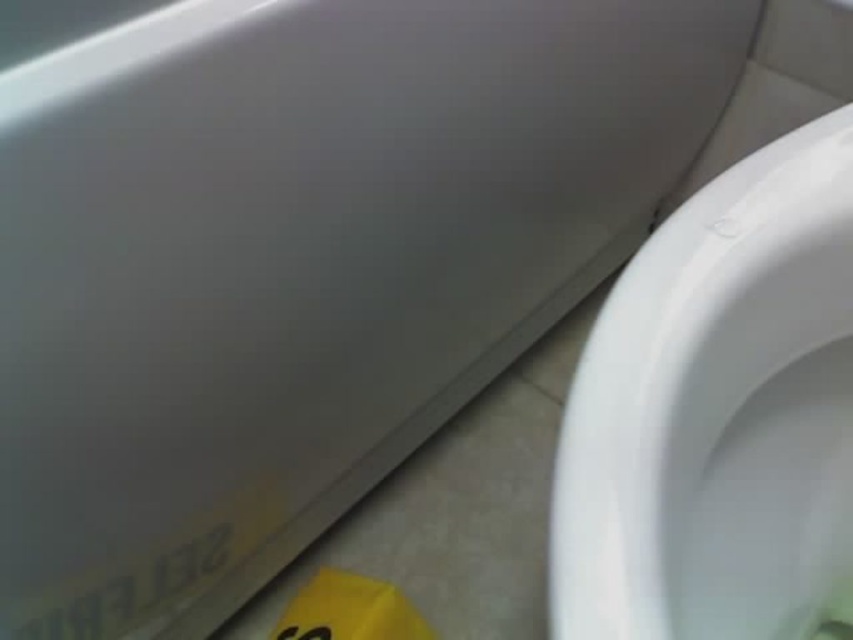
Between white glossy toilet bowl at right and yellow paper at lower left, which one has less height?

With less height is yellow paper at lower left.

The width and height of the screenshot is (853, 640). What do you see at coordinates (718, 413) in the screenshot?
I see `white glossy toilet bowl at right` at bounding box center [718, 413].

This screenshot has width=853, height=640. What do you see at coordinates (718, 413) in the screenshot?
I see `white glossy toilet bowl at right` at bounding box center [718, 413].

Find the location of a particular element. This screenshot has height=640, width=853. white glossy toilet bowl at right is located at coordinates (718, 413).